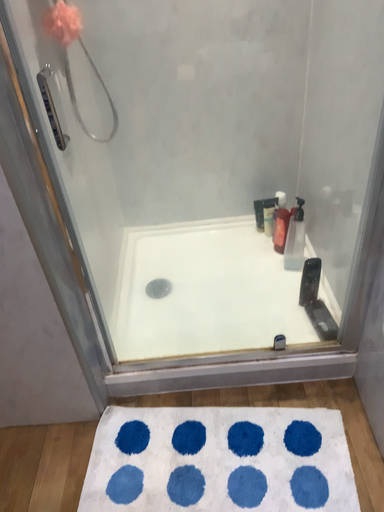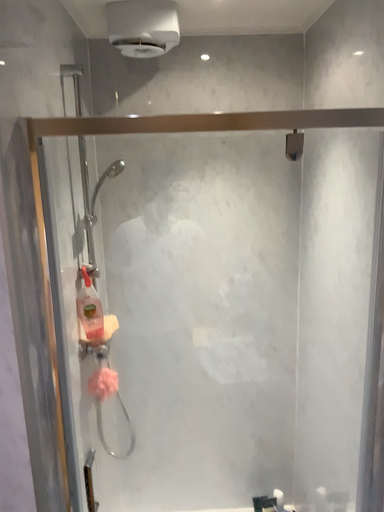
Question: Which way did the camera rotate in the video?

Choices:
 (A) rotated downward
 (B) rotated upward

Answer: (B)